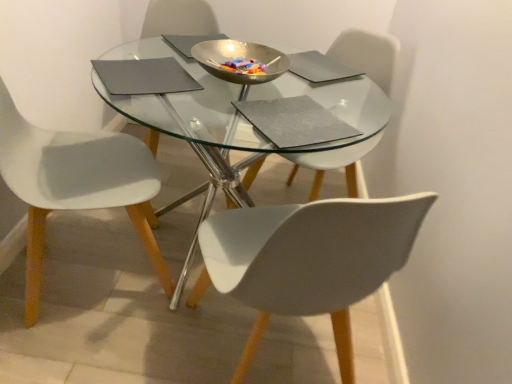
What is the approximate height of white plastic chair at lower right, the 2th chair viewed from the left?

white plastic chair at lower right, the 2th chair viewed from the left, is 31.83 inches in height.

What do you see at coordinates (309, 260) in the screenshot?
I see `white plastic chair at lower right, the 2th chair viewed from the left` at bounding box center [309, 260].

Image resolution: width=512 pixels, height=384 pixels. What do you see at coordinates (246, 121) in the screenshot? I see `transparent glass table at center` at bounding box center [246, 121].

This screenshot has height=384, width=512. I want to click on transparent glass table at center, so click(246, 121).

Find the location of a particular element. matte gray pad at upper left is located at coordinates (144, 76).

I want to click on white plastic chair at lower right, which is the second chair in right-to-left order, so click(x=309, y=260).

You are a GUI agent. You are given a task and a screenshot of the screen. Output one action in this format:
    pyautogui.click(x=<x>, y=<y>)
    Task: Click on the 3rd chair below the matte gray pad at upper left (from the image's perspective)
    The width and height of the screenshot is (512, 384).
    Given the screenshot: What is the action you would take?
    pyautogui.click(x=309, y=260)

Looking at this image, considering the positions of objects white plastic chair at lower right, the 2th chair viewed from the left, and matte gray pad at upper left in the image provided, who is more to the left, white plastic chair at lower right, the 2th chair viewed from the left, or matte gray pad at upper left?

matte gray pad at upper left.

Is white plastic chair at lower right, the 2th chair viewed from the left, far from matte gray pad at upper left?

No, white plastic chair at lower right, the 2th chair viewed from the left, is not far from matte gray pad at upper left.

Are matte gray pad at upper left and transparent glass table at center located far from each other?

No, matte gray pad at upper left is in close proximity to transparent glass table at center.

Is matte gray pad at upper left facing towards transparent glass table at center?

No, matte gray pad at upper left is not aimed at transparent glass table at center.

Is matte gray pad at upper left not inside transparent glass table at center?

No, matte gray pad at upper left is inside transparent glass table at center's boundary.

Does matte gray pad at upper left have a lesser height compared to transparent glass table at center?

Indeed, matte gray pad at upper left has a lesser height compared to transparent glass table at center.

From the picture: Is metallic gold bowl at center directly adjacent to matte gray pad at upper left?

No, metallic gold bowl at center is not beside matte gray pad at upper left.

Is point (222, 51) positioned before point (126, 85)?

That is False.

From a real-world perspective, is metallic gold bowl at center located beneath matte gray pad at upper left?

Incorrect, from a real-world perspective, metallic gold bowl at center is higher than matte gray pad at upper left.

Can we say metallic gold bowl at center lies outside matte gray pad at upper left?

Yes, metallic gold bowl at center is not within matte gray pad at upper left.

Considering the relative positions of white plastic chair at lower right, the 2th chair viewed from the left, and metallic gold bowl at center in the image provided, is white plastic chair at lower right, the 2th chair viewed from the left, to the left or to the right of metallic gold bowl at center?

white plastic chair at lower right, the 2th chair viewed from the left, is positioned on metallic gold bowl at center's right side.

Who is bigger, white plastic chair at lower right, which is the second chair in right-to-left order, or metallic gold bowl at center?

white plastic chair at lower right, which is the second chair in right-to-left order.

Can you confirm if white plastic chair at lower right, which is the second chair in right-to-left order, is wider than metallic gold bowl at center?

Yes.

Considering the relative positions of white plastic chair at lower right, which is the second chair in right-to-left order, and metallic gold bowl at center in the image provided, is white plastic chair at lower right, which is the second chair in right-to-left order, in front of metallic gold bowl at center?

Yes, white plastic chair at lower right, which is the second chair in right-to-left order, is in front of metallic gold bowl at center.

Find the location of `the 2nd chair above the transparent glass table at center (from the image's perspective)`. the 2nd chair above the transparent glass table at center (from the image's perspective) is located at coordinates (368, 55).

Can you confirm if transparent glass table at center is shorter than white plastic chair at center, the third chair positioned from the left?

Indeed, transparent glass table at center has a lesser height compared to white plastic chair at center, the third chair positioned from the left.

Measure the distance between transparent glass table at center and white plastic chair at center, which ranks as the 1th chair in right-to-left order.

A distance of 11.87 inches exists between transparent glass table at center and white plastic chair at center, which ranks as the 1th chair in right-to-left order.

Which object is closer to the camera, transparent glass table at center or white plastic chair at center, the third chair positioned from the left?

transparent glass table at center.

From the image's perspective, between transparent glass table at center and transparent glass bowl at center, who is located below?

transparent glass table at center.

Locate an element on the screen. armchair on the left of transparent glass table at center is located at coordinates (179, 18).

Can you tell me how much transparent glass table at center and transparent glass bowl at center differ in facing direction?

The angle between the facing direction of transparent glass table at center and the facing direction of transparent glass bowl at center is 14.5 degrees.

Is transparent glass table at center behind transparent glass bowl at center?

No, transparent glass table at center is closer to the camera.

From the picture: From a real-world perspective, who is located higher, transparent glass bowl at center or matte gray pad at upper left?

matte gray pad at upper left, from a real-world perspective.

Which object is closer to the camera, transparent glass bowl at center or matte gray pad at upper left?

matte gray pad at upper left is in front.

Is transparent glass bowl at center looking in the opposite direction of matte gray pad at upper left?

No.

I want to click on pad that is in front of the transparent glass bowl at center, so click(144, 76).

What are the coordinates of `chair that is the 2nd object located in front of the matte gray pad at upper left` in the screenshot? It's located at (309, 260).

At what (x,y) coordinates should I click in order to perform the action: click on pad on the left of transparent glass table at center. Please return your answer as a coordinate pair (x, y). This screenshot has width=512, height=384. Looking at the image, I should click on (144, 76).

Based on the photo, looking at the image, which one is located closer to transparent glass bowl at center, metallic gold bowl at center or matte gray pad at upper left?

metallic gold bowl at center.

Based on their spatial positions, is white matte chair at lower left, which is the first chair from left to right, or metallic gold bowl at center closer to transparent glass bowl at center?

The object closer to transparent glass bowl at center is metallic gold bowl at center.

Consider the image. Based on their spatial positions, is transparent glass table at center or metallic gold bowl at center closer to white plastic chair at lower right, the 2th chair viewed from the left?

The object closer to white plastic chair at lower right, the 2th chair viewed from the left, is transparent glass table at center.

Based on their spatial positions, is white plastic chair at center, the third chair positioned from the left, or matte gray pad at upper left further from transparent glass bowl at center?

white plastic chair at center, the third chair positioned from the left, is further to transparent glass bowl at center.

When comparing their distances from white plastic chair at lower right, which is the second chair in right-to-left order, does white matte chair at lower left, the 3th chair positioned from the right, or white plastic chair at center, which ranks as the 1th chair in right-to-left order, seem closer?

The object closer to white plastic chair at lower right, which is the second chair in right-to-left order, is white plastic chair at center, which ranks as the 1th chair in right-to-left order.

From the image, which object appears to be nearer to white matte chair at lower left, which is the first chair from left to right, matte gray pad at upper left or white plastic chair at lower right, the 2th chair viewed from the left?

matte gray pad at upper left is positioned closer to the anchor white matte chair at lower left, which is the first chair from left to right.

From the image, which object appears to be nearer to transparent glass table at center, white matte chair at lower left, the 3th chair positioned from the right, or transparent glass bowl at center?

white matte chair at lower left, the 3th chair positioned from the right, is closer to transparent glass table at center.

From the image, which object appears to be nearer to matte gray pad at upper left, white plastic chair at center, the third chair positioned from the left, or transparent glass bowl at center?

white plastic chair at center, the third chair positioned from the left, is closer to matte gray pad at upper left.

Where is `coffee table located between white matte chair at lower left, which is the first chair from left to right, and white plastic chair at center, the third chair positioned from the left, in the left-right direction`? coffee table located between white matte chair at lower left, which is the first chair from left to right, and white plastic chair at center, the third chair positioned from the left, in the left-right direction is located at coordinates (246, 121).

Where is `coffee table between matte gray pad at upper left and white plastic chair at lower right, which is the second chair in right-to-left order, vertically`? This screenshot has width=512, height=384. coffee table between matte gray pad at upper left and white plastic chair at lower right, which is the second chair in right-to-left order, vertically is located at coordinates (246, 121).

You are a GUI agent. You are given a task and a screenshot of the screen. Output one action in this format:
    pyautogui.click(x=<x>, y=<y>)
    Task: Click on the bowl located between white matte chair at lower left, the 3th chair positioned from the right, and white plastic chair at lower right, the 2th chair viewed from the left, in the left-right direction
    Image resolution: width=512 pixels, height=384 pixels.
    Given the screenshot: What is the action you would take?
    pyautogui.click(x=239, y=57)

The width and height of the screenshot is (512, 384). I want to click on bowl positioned between matte gray pad at upper left and transparent glass bowl at center from near to far, so click(x=239, y=57).